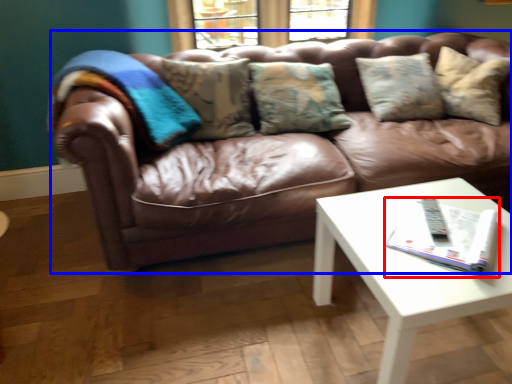
Question: Among these objects, which one is farthest to the camera, magazine (highlighted by a red box) or studio couch (highlighted by a blue box)?

Choices:
 (A) magazine
 (B) studio couch

Answer: (B)